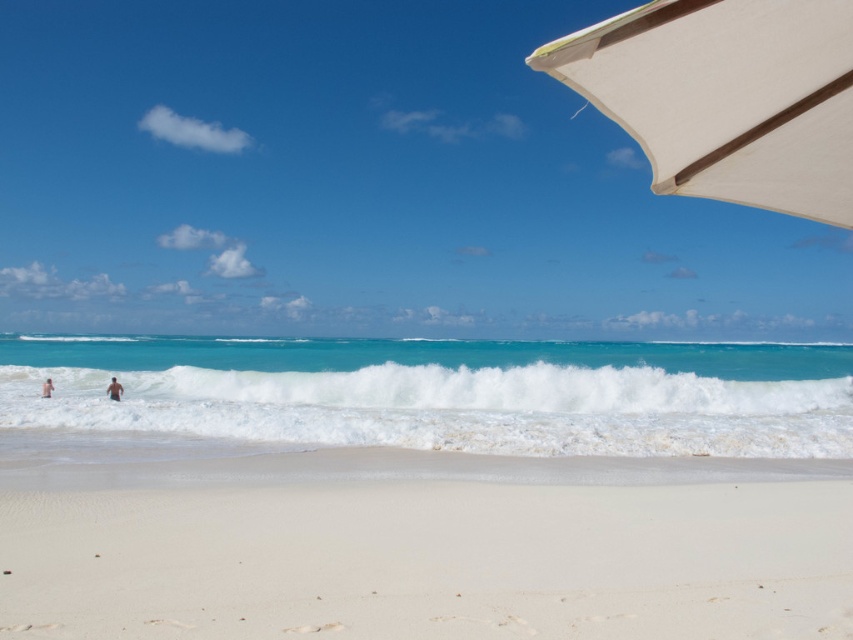
In the scene shown: Can you confirm if white sandy beach at lower center is shorter than skinny man at left?

Incorrect, white sandy beach at lower center's height does not fall short of skinny man at left's.

Is white sandy beach at lower center bigger than skinny man at left?

Answer: Yes.

Does point (607, 509) come farther from viewer compared to point (45, 387)?

No, (607, 509) is closer to viewer.

The width and height of the screenshot is (853, 640). I want to click on white sandy beach at lower center, so click(x=421, y=545).

Is white sandy beach at lower center positioned in front of white fabric umbrella at upper right?

No, white sandy beach at lower center is further to the viewer.

What do you see at coordinates (421, 545) in the screenshot? The width and height of the screenshot is (853, 640). I see `white sandy beach at lower center` at bounding box center [421, 545].

Between point (397, 609) and point (683, 60), which one is positioned in front?

Point (683, 60)

At what (x,y) coordinates should I click in order to perform the action: click on white sandy beach at lower center. Please return your answer as a coordinate pair (x, y). This screenshot has height=640, width=853. Looking at the image, I should click on (421, 545).

Measure the distance from white sandy beach at lower center to blurred skin person at lower left.

13.63 meters

In the scene shown: Who is positioned more to the right, white sandy beach at lower center or blurred skin person at lower left?

white sandy beach at lower center is more to the right.

Identify the location of white sandy beach at lower center. This screenshot has height=640, width=853. (421, 545).